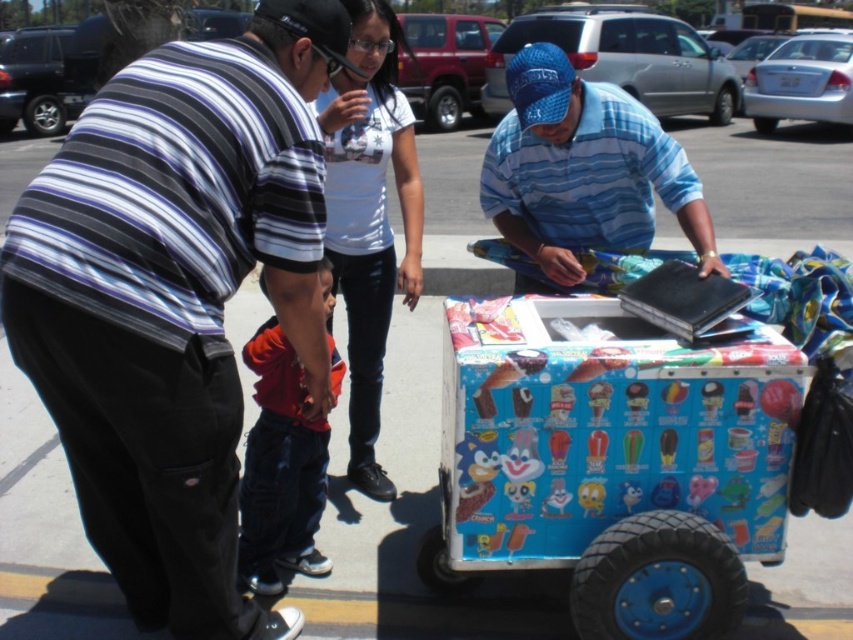
Between blue plastic wagon at lower center and white matte shirt at upper center, which one has more height?

Standing taller between the two is white matte shirt at upper center.

Consider the image. Does blue plastic wagon at lower center appear on the left side of white matte shirt at upper center?

No, blue plastic wagon at lower center is not to the left of white matte shirt at upper center.

Is point (541, 490) positioned after point (369, 1)?

No, (541, 490) is closer to viewer.

Where is `blue plastic wagon at lower center`? blue plastic wagon at lower center is located at coordinates tap(612, 460).

What do you see at coordinates (369, 218) in the screenshot?
I see `white matte shirt at upper center` at bounding box center [369, 218].

Is white matte shirt at upper center shorter than orange fabric pants at lower center?

No.

Which is in front, point (351, 188) or point (239, 529)?

Positioned in front is point (239, 529).

Where is `white matte shirt at upper center`? The width and height of the screenshot is (853, 640). white matte shirt at upper center is located at coordinates (369, 218).

Looking at this image, who is more distant from viewer, (711,269) or (358,28)?

A: The point (358,28) is more distant.

Who is shorter, blue striped shirt at center or white matte shirt at upper center?

Standing shorter between the two is blue striped shirt at center.

The width and height of the screenshot is (853, 640). Find the location of `blue striped shirt at center`. blue striped shirt at center is located at coordinates (584, 170).

The height and width of the screenshot is (640, 853). I want to click on blue striped shirt at center, so click(584, 170).